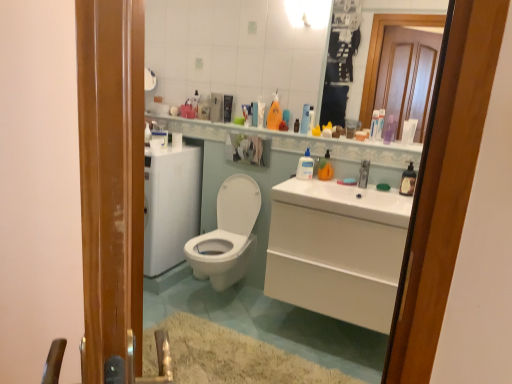
I want to click on free point below white glossy vanity at lower right (from a real-world perspective), so click(327, 335).